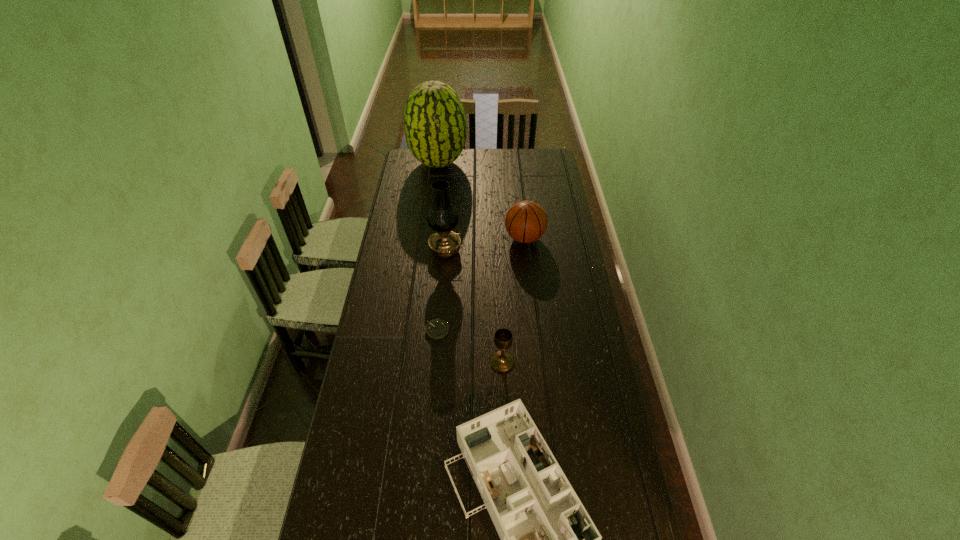
This screenshot has height=540, width=960. I want to click on free region located on the back of the third tallest object, so click(522, 218).

This screenshot has height=540, width=960. Identify the location of vacant space located on the back of the chalice. (499, 302).

I want to click on vacant space located 0.110m on the front of the shortest object, so click(x=434, y=363).

Locate an element on the screen. object that is positioned at the far edge is located at coordinates (435, 125).

Identify the location of object that is at the left edge. click(x=435, y=125).

The height and width of the screenshot is (540, 960). I want to click on object present at the right edge, so click(526, 221).

The height and width of the screenshot is (540, 960). Identify the location of object that is at the far left corner. (435, 125).

I want to click on vacant space at the far edge of the desktop, so click(511, 169).

The image size is (960, 540). What are the coordinates of `free region at the left edge` in the screenshot? It's located at (373, 391).

Where is `vacant area at the right edge`? vacant area at the right edge is located at coordinates (545, 249).